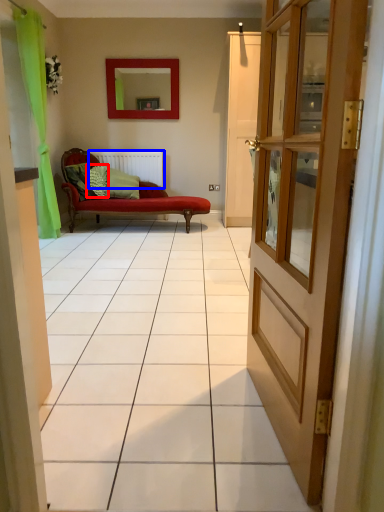
Question: Which object appears closest to the camera in this image, pillow (highlighted by a red box) or radiator (highlighted by a blue box)?

Choices:
 (A) pillow
 (B) radiator

Answer: (A)